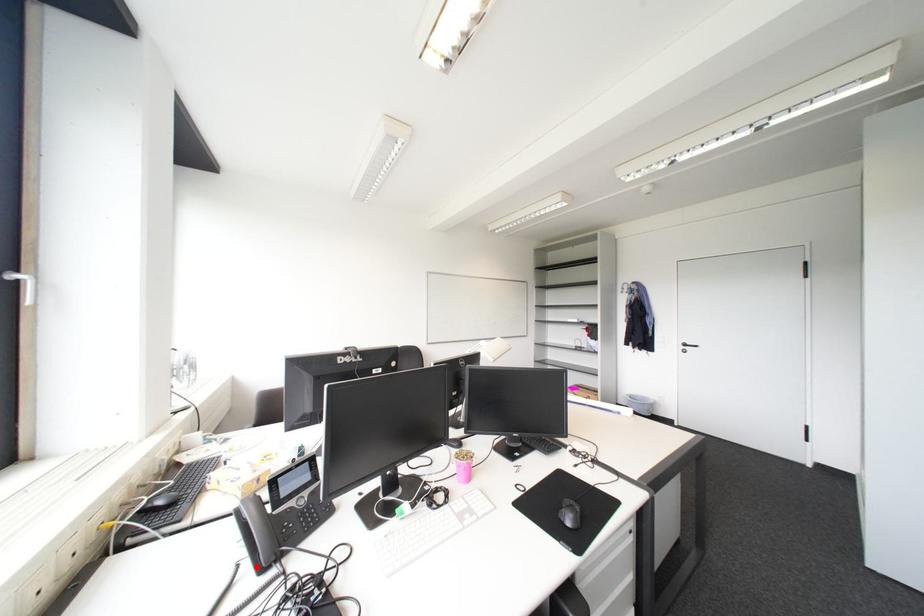
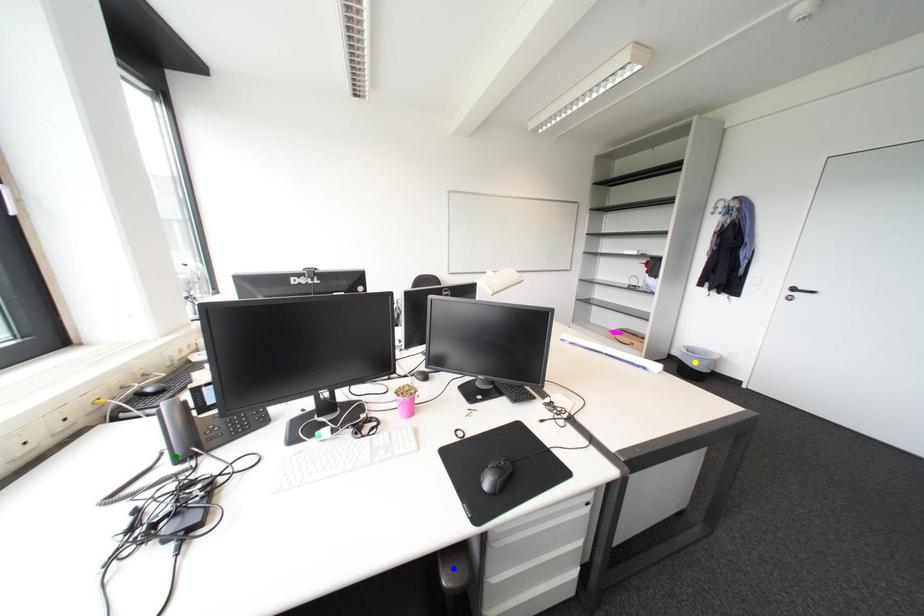
Question: I am providing you with two images of the same scene from different viewpoints. A red point is marked on the first image. You are given multiple points on the second image. In image 2, which mark is for the same physical point as the one in image 1?

Choices:
 (A) green point
 (B) yellow point
 (C) blue point

Answer: (A)